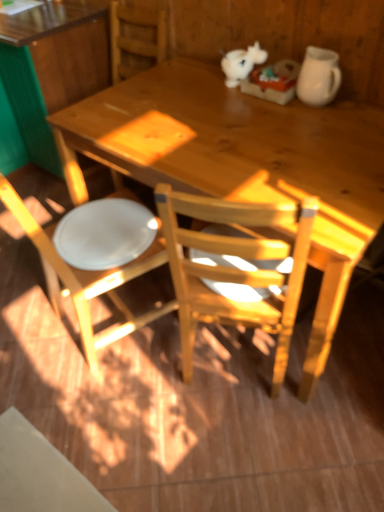
Locate an element on the screen. The height and width of the screenshot is (512, 384). vacant space in front of white matte unicorn at upper center is located at coordinates (236, 95).